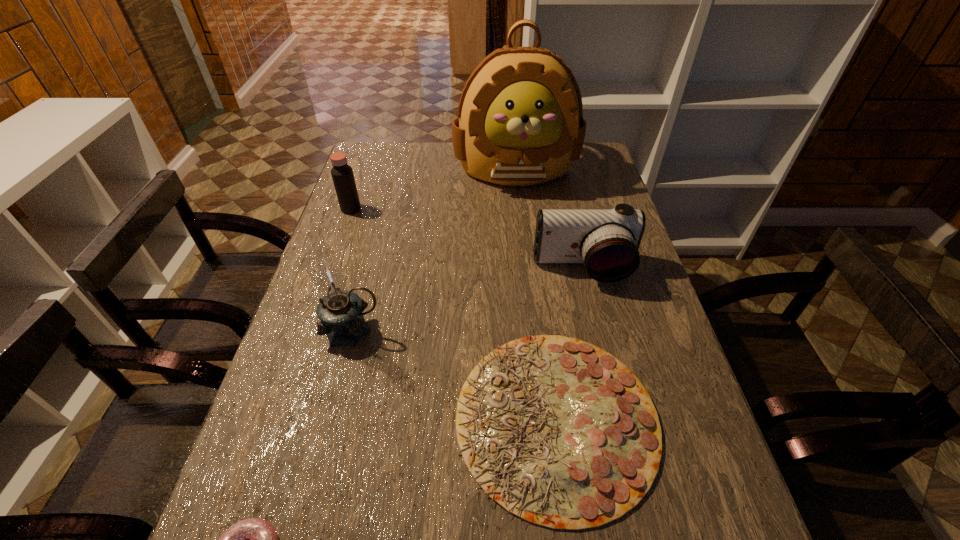
Locate an element on the screen. the farthest object is located at coordinates (520, 122).

You are a GUI agent. You are given a task and a screenshot of the screen. Output one action in this format:
    pyautogui.click(x=<x>, y=<y>)
    Task: Click on the tallest object
    The height and width of the screenshot is (540, 960).
    Given the screenshot: What is the action you would take?
    pyautogui.click(x=520, y=122)

Image resolution: width=960 pixels, height=540 pixels. What are the coordinates of `oil lamp` in the screenshot? It's located at (340, 311).

The image size is (960, 540). In order to click on the fifth nearest object in this screenshot , I will do `click(342, 174)`.

Image resolution: width=960 pixels, height=540 pixels. I want to click on the fourth nearest object, so click(x=607, y=241).

Where is `pizza`? The height and width of the screenshot is (540, 960). pizza is located at coordinates (560, 433).

Image resolution: width=960 pixels, height=540 pixels. I want to click on vacant area situated on the front-facing side of the farthest object, so click(522, 227).

The image size is (960, 540). Identify the location of vacant region located on the front of the second tallest object. (336, 396).

Image resolution: width=960 pixels, height=540 pixels. Find the location of `vacant region located on the back of the vinegar`. vacant region located on the back of the vinegar is located at coordinates (358, 189).

Where is `vacant space located 0.200m on the surface of the camcorder`? This screenshot has width=960, height=540. vacant space located 0.200m on the surface of the camcorder is located at coordinates (602, 348).